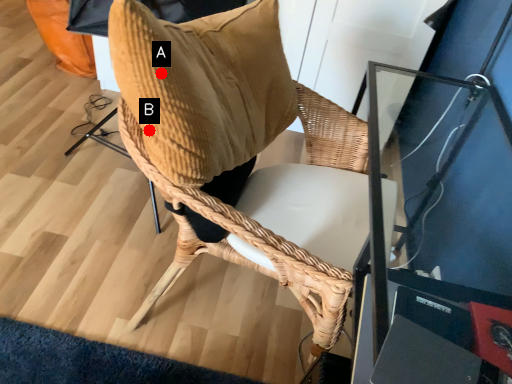
Question: Two points are circled on the image, labeled by A and B beside each circle. Which point is closer to the camera?

Choices:
 (A) A is closer
 (B) B is closer

Answer: (A)